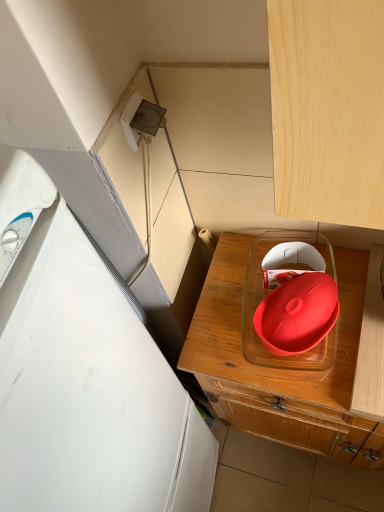
Question: Does matte plastic tray at center have a lesser width compared to white plastic refrigerator at left?

Choices:
 (A) yes
 (B) no

Answer: (B)

Question: Can you see matte plastic tray at center touching white plastic refrigerator at left?

Choices:
 (A) no
 (B) yes

Answer: (A)

Question: Is matte plastic tray at center taller than white plastic refrigerator at left?

Choices:
 (A) no
 (B) yes

Answer: (A)

Question: Is matte plastic tray at center aimed at white plastic refrigerator at left?

Choices:
 (A) no
 (B) yes

Answer: (A)

Question: Can you confirm if matte plastic tray at center is bigger than white plastic refrigerator at left?

Choices:
 (A) yes
 (B) no

Answer: (B)

Question: Is matte plastic tray at center oriented away from white plastic refrigerator at left?

Choices:
 (A) yes
 (B) no

Answer: (B)

Question: From the image's perspective, would you say white plastic refrigerator at left is positioned over matte plastic tray at center?

Choices:
 (A) no
 (B) yes

Answer: (A)

Question: Is white plastic refrigerator at left bigger than matte plastic tray at center?

Choices:
 (A) yes
 (B) no

Answer: (A)

Question: Is white plastic refrigerator at left thinner than matte plastic tray at center?

Choices:
 (A) yes
 (B) no

Answer: (A)

Question: Is white plastic refrigerator at left positioned before matte plastic tray at center?

Choices:
 (A) yes
 (B) no

Answer: (A)

Question: Does white plastic refrigerator at left come behind matte plastic tray at center?

Choices:
 (A) yes
 (B) no

Answer: (B)

Question: Is white plastic refrigerator at left oriented away from matte plastic tray at center?

Choices:
 (A) no
 (B) yes

Answer: (A)

Question: Is white plastic refrigerator at left at the back of rubberized red lid at center?

Choices:
 (A) no
 (B) yes

Answer: (A)